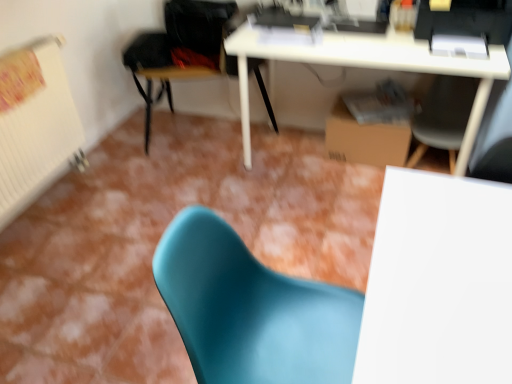
Locate an element on the screen. free space in front of brown cardboard box at lower right is located at coordinates (348, 192).